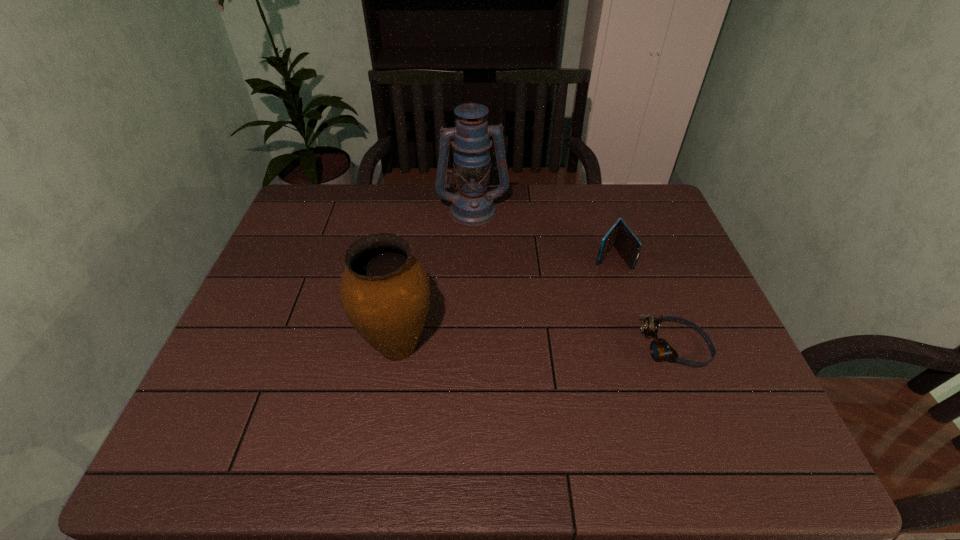
I want to click on vacant space at the far left corner of the desktop, so click(x=350, y=187).

The height and width of the screenshot is (540, 960). What are the coordinates of `vacant space at the near left corner` in the screenshot? It's located at (252, 409).

In the image, there is a desktop. Identify the location of vacant space at the near right corner. Image resolution: width=960 pixels, height=540 pixels. (748, 414).

Locate an element on the screen. unoccupied position between the third tallest object and the lantern is located at coordinates (542, 233).

Where is `free spot between the third nearest object and the third shortest object`? This screenshot has height=540, width=960. free spot between the third nearest object and the third shortest object is located at coordinates [504, 301].

Find the location of `vacant area between the shortest object and the lantern`. vacant area between the shortest object and the lantern is located at coordinates (574, 279).

Locate an element on the screen. Image resolution: width=960 pixels, height=540 pixels. vacant space that is in between the shortest object and the tallest object is located at coordinates (574, 279).

Locate an element on the screen. free space between the lantern and the goggles is located at coordinates (574, 279).

You are a GUI agent. You are given a task and a screenshot of the screen. Output one action in this format:
    pyautogui.click(x=<x>, y=<y>)
    Task: Click on the free space between the wallet and the third shortest object
    Image resolution: width=960 pixels, height=540 pixels.
    Given the screenshot: What is the action you would take?
    pyautogui.click(x=504, y=301)

You are a GUI agent. You are given a task and a screenshot of the screen. Output one action in this format:
    pyautogui.click(x=<x>, y=<y>)
    Task: Click on the empty space that is in between the goggles and the third shortest object
    This screenshot has height=540, width=960.
    Given the screenshot: What is the action you would take?
    pyautogui.click(x=537, y=347)